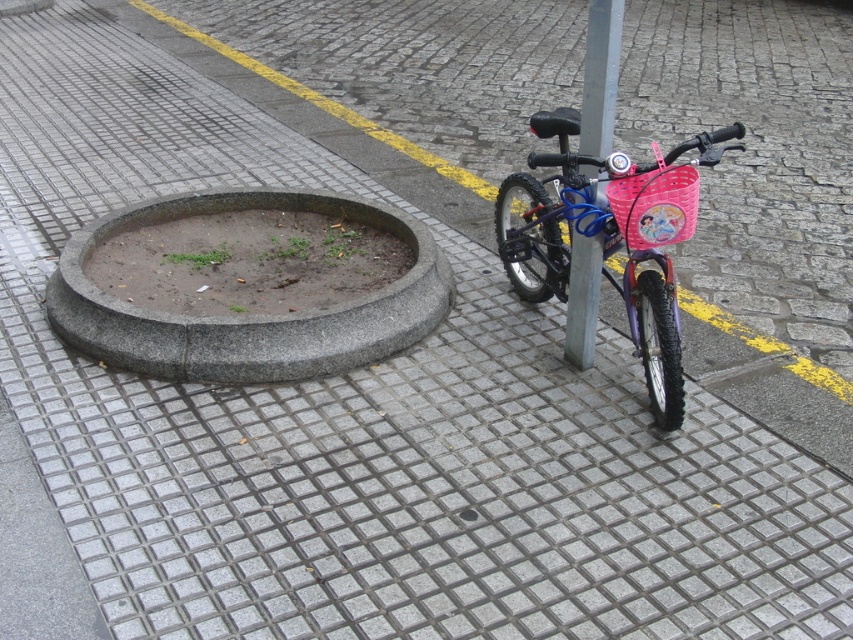
Between point (374, 339) and point (595, 42), which one is positioned behind?

Point (374, 339)

Find the location of a particular element. The width and height of the screenshot is (853, 640). gray concrete curb at center is located at coordinates (242, 316).

Who is more distant from viewer, (62, 294) or (518, 292)?

Point (518, 292)

Who is lower down, gray concrete curb at center or pink plastic bicycle at center-right?

gray concrete curb at center is lower down.

Measure the distance between gray concrete curb at center and camera.

8.62 feet

Identify the location of gray concrete curb at center. This screenshot has height=640, width=853. (242, 316).

Is pink plastic bicycle at center-right closer to the viewer compared to metallic gray pole at center?

Yes, pink plastic bicycle at center-right is closer to the viewer.

Is pink plastic bicycle at center-right bigger than metallic gray pole at center?

Correct, pink plastic bicycle at center-right is larger in size than metallic gray pole at center.

This screenshot has width=853, height=640. Describe the element at coordinates (611, 236) in the screenshot. I see `pink plastic bicycle at center-right` at that location.

Locate an element on the screen. Image resolution: width=853 pixels, height=640 pixels. pink plastic bicycle at center-right is located at coordinates (611, 236).